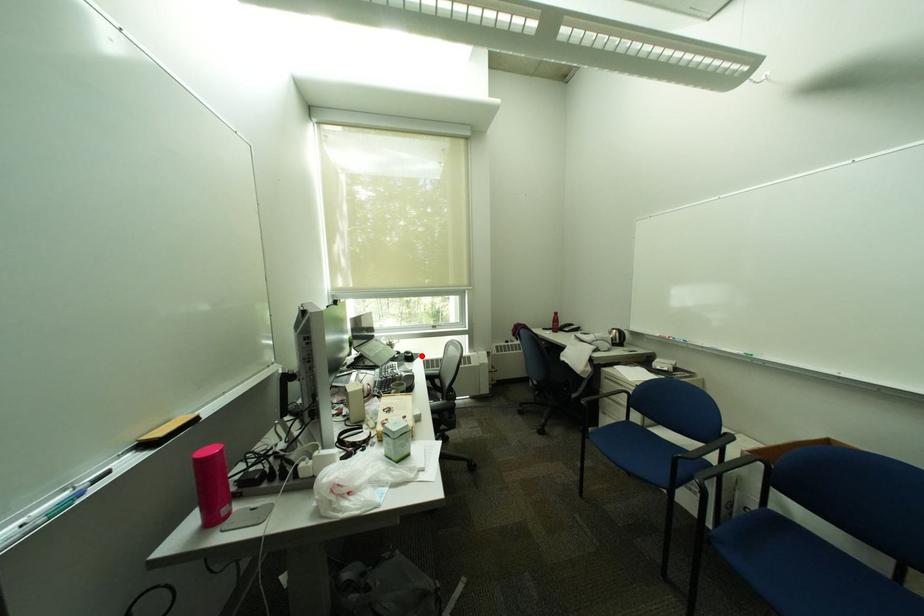
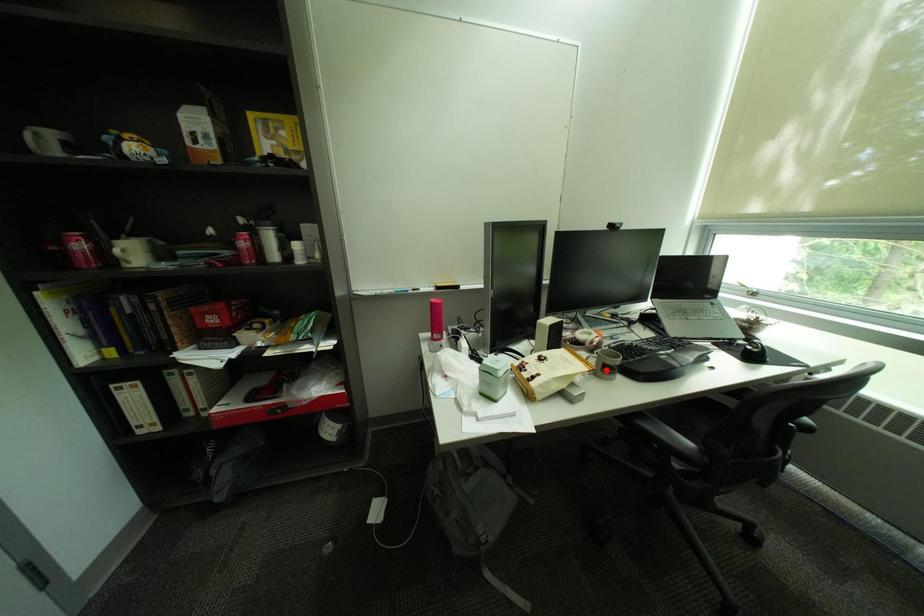
I am providing you with two images of the same scene from different viewpoints. A red point is marked on the first image and another point is marked on the second image. Is the red point in image1 aligned with the point shown in image2?

No